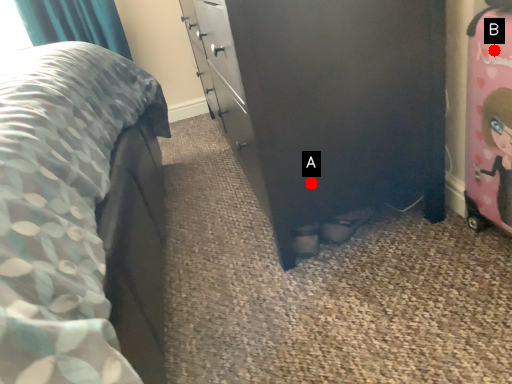
Question: Two points are circled on the image, labeled by A and B beside each circle. Which point is farther from the camera taking this photo?

Choices:
 (A) A is further
 (B) B is further

Answer: (A)